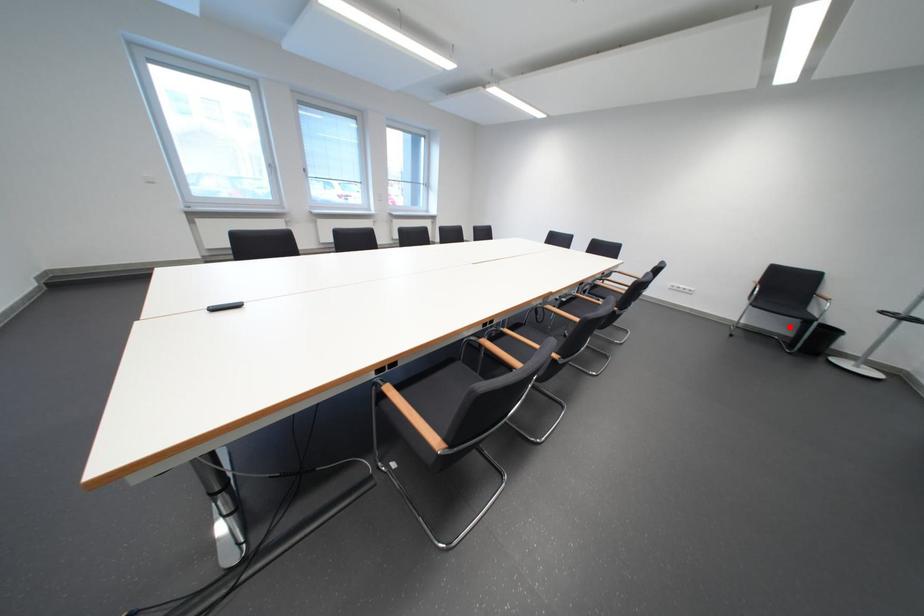
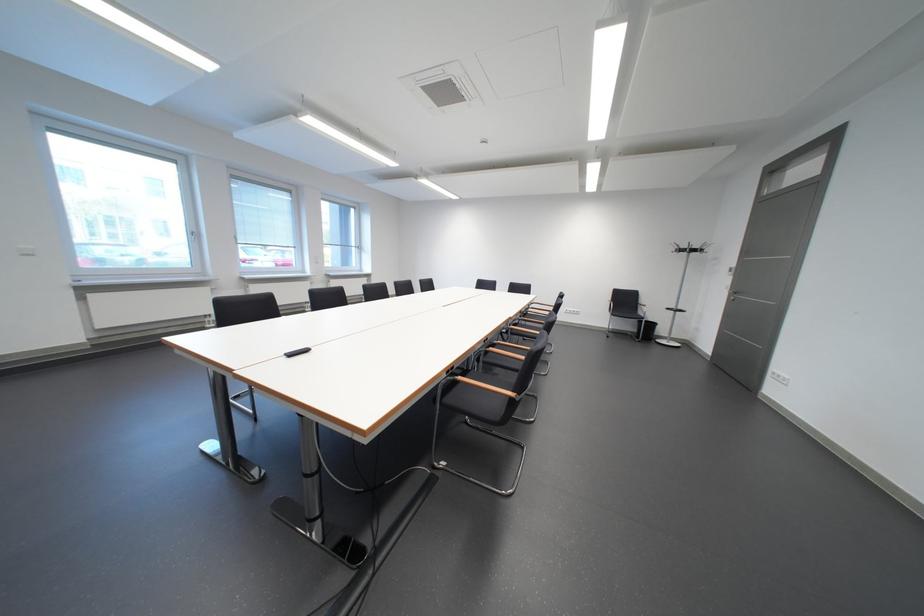
The point at the highlighted location is marked in the first image. Where is the corresponding point in the second image?

(640, 328)